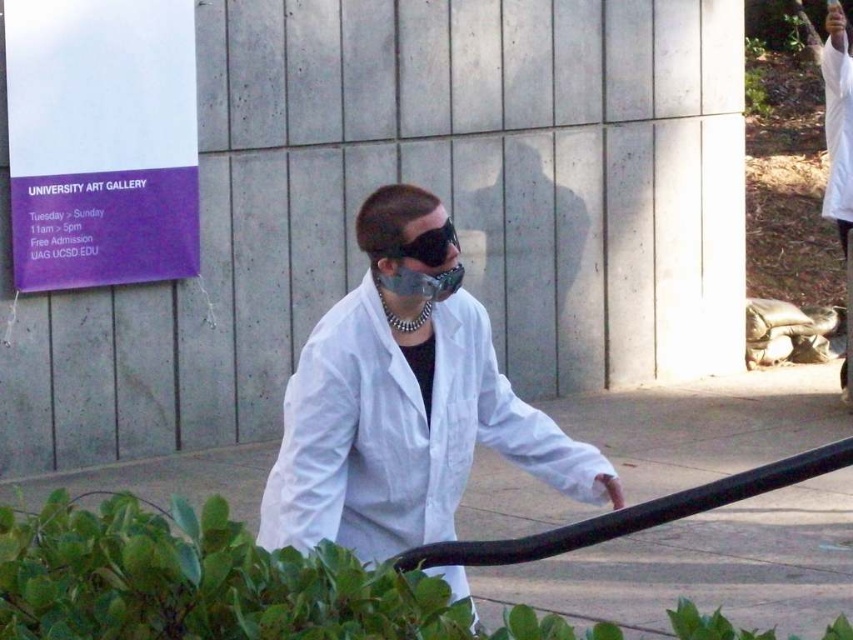
Question: Which of the following is the farthest from the observer?

Choices:
 (A) black matte sunglasses at center
 (B) white matte lab coat at center

Answer: (A)

Question: Does white matte lab coat at center have a larger size compared to black matte sunglasses at center?

Choices:
 (A) yes
 (B) no

Answer: (A)

Question: Does white matte lab coat at center have a greater width compared to black matte sunglasses at center?

Choices:
 (A) yes
 (B) no

Answer: (A)

Question: Is white matte lab coat at center closer to the viewer compared to black matte sunglasses at center?

Choices:
 (A) yes
 (B) no

Answer: (A)